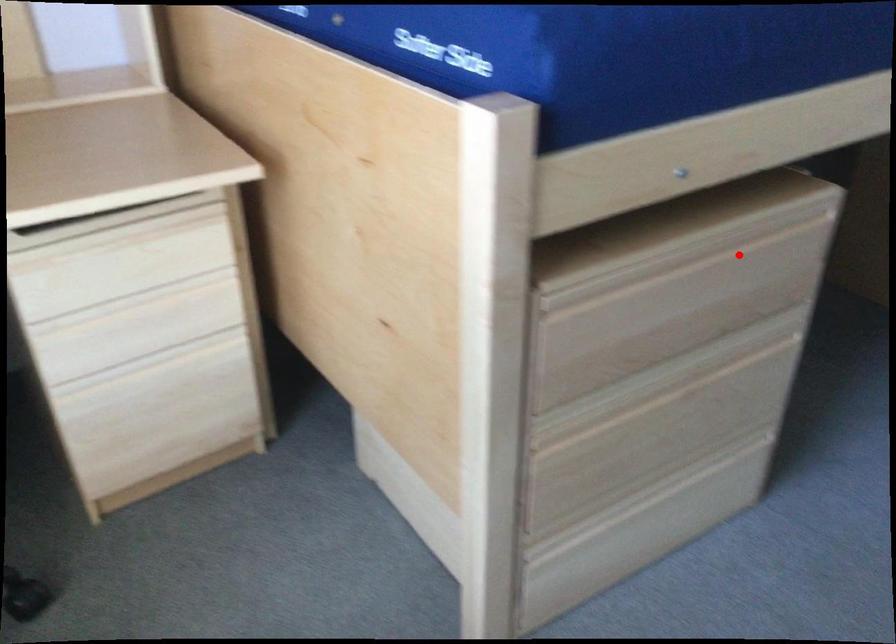
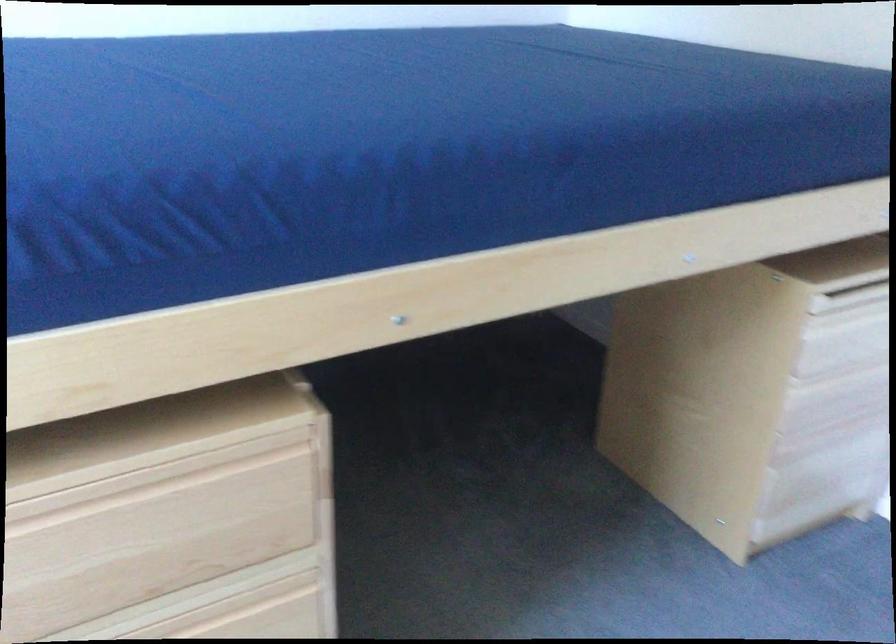
Question: I am providing you with two images of the same scene from different viewpoints. Given a red point in image1, look at the same physical point in image2. Is it:

Choices:
 (A) Closer to the viewpoint
 (B) Farther from the viewpoint

Answer: (A)